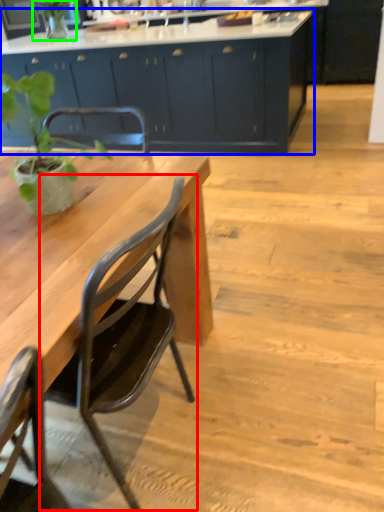
Question: Which is farther away from chair (highlighted by a red box)? cabinetry (highlighted by a blue box) or plant (highlighted by a green box)?

Choices:
 (A) cabinetry
 (B) plant

Answer: (B)